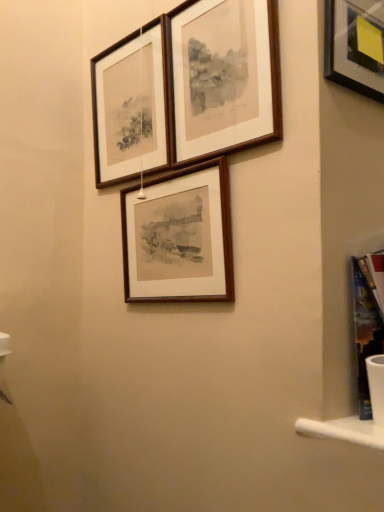
Question: Which direction should I rotate to look at wooden frame at center, the 3th picture frame positioned from the top, — up or down?

Choices:
 (A) down
 (B) up

Answer: (B)

Question: Is wooden frame at center, the 3th picture frame positioned from the top, outside wooden frame at upper center, the 2th picture frame when ordered from top to bottom?

Choices:
 (A) yes
 (B) no

Answer: (A)

Question: Does wooden frame at center, which is the 1th picture frame in bottom-to-top order, touch wooden frame at upper center, the 2th picture frame when ordered from top to bottom?

Choices:
 (A) yes
 (B) no

Answer: (B)

Question: Can you confirm if wooden frame at center, which is the 1th picture frame in bottom-to-top order, is shorter than wooden frame at upper center, the 2th picture frame from the bottom?

Choices:
 (A) yes
 (B) no

Answer: (A)

Question: Can you confirm if wooden frame at center, the 3th picture frame positioned from the top, is wider than wooden frame at upper center, the 2th picture frame from the bottom?

Choices:
 (A) no
 (B) yes

Answer: (B)

Question: Is wooden frame at center, which is the 1th picture frame in bottom-to-top order, turned away from wooden frame at upper center, the 2th picture frame from the bottom?

Choices:
 (A) yes
 (B) no

Answer: (B)

Question: From a real-world perspective, does wooden frame at center, the 3th picture frame positioned from the top, stand above wooden frame at upper center, the 2th picture frame from the bottom?

Choices:
 (A) yes
 (B) no

Answer: (B)

Question: Is wooden frame at upper center, the 2th picture frame when ordered from top to bottom, bigger than wooden frame at center, which is the 1th picture frame in bottom-to-top order?

Choices:
 (A) no
 (B) yes

Answer: (B)

Question: Considering the relative positions of wooden frame at upper center, the 2th picture frame from the bottom, and wooden frame at center, the 3th picture frame positioned from the top, in the image provided, is wooden frame at upper center, the 2th picture frame from the bottom, behind wooden frame at center, the 3th picture frame positioned from the top,?

Choices:
 (A) yes
 (B) no

Answer: (A)

Question: Would you say wooden frame at upper center, the 2th picture frame when ordered from top to bottom, is outside wooden frame at center, the 3th picture frame positioned from the top?

Choices:
 (A) no
 (B) yes

Answer: (B)

Question: Can wooden frame at center, which is the 1th picture frame in bottom-to-top order, be found inside wooden frame at upper center, the 2th picture frame when ordered from top to bottom?

Choices:
 (A) yes
 (B) no

Answer: (B)

Question: Is wooden frame at upper center, the 2th picture frame from the bottom, aimed at wooden frame at center, which is the 1th picture frame in bottom-to-top order?

Choices:
 (A) yes
 (B) no

Answer: (B)

Question: Is wooden frame at center, which is the 1th picture frame in bottom-to-top order, at the back of wooden frame at upper center, the 2th picture frame when ordered from top to bottom?

Choices:
 (A) no
 (B) yes

Answer: (A)

Question: Could you tell me if wooden frame at center, which is the 1th picture frame in bottom-to-top order, is turned towards wooden frame at upper center, which appears as the 1th picture frame when viewed from the top?

Choices:
 (A) yes
 (B) no

Answer: (B)